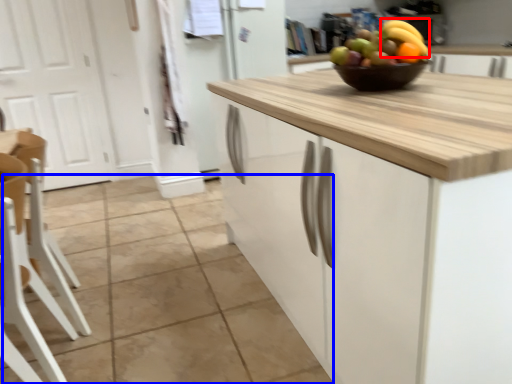
Question: Which object appears closest to the camera in this image, banana (highlighted by a red box) or tile (highlighted by a blue box)?

Choices:
 (A) banana
 (B) tile

Answer: (B)